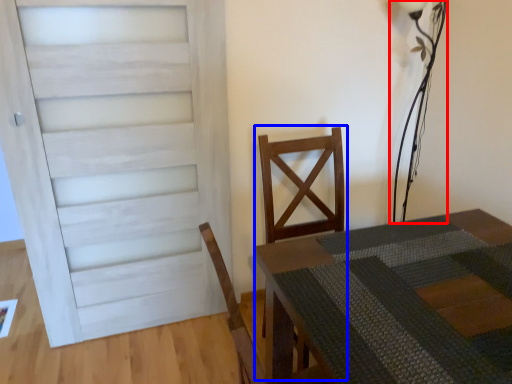
Question: Which of the following is the farthest to the observer, table lamp (highlighted by a red box) or armchair (highlighted by a blue box)?

Choices:
 (A) table lamp
 (B) armchair

Answer: (A)